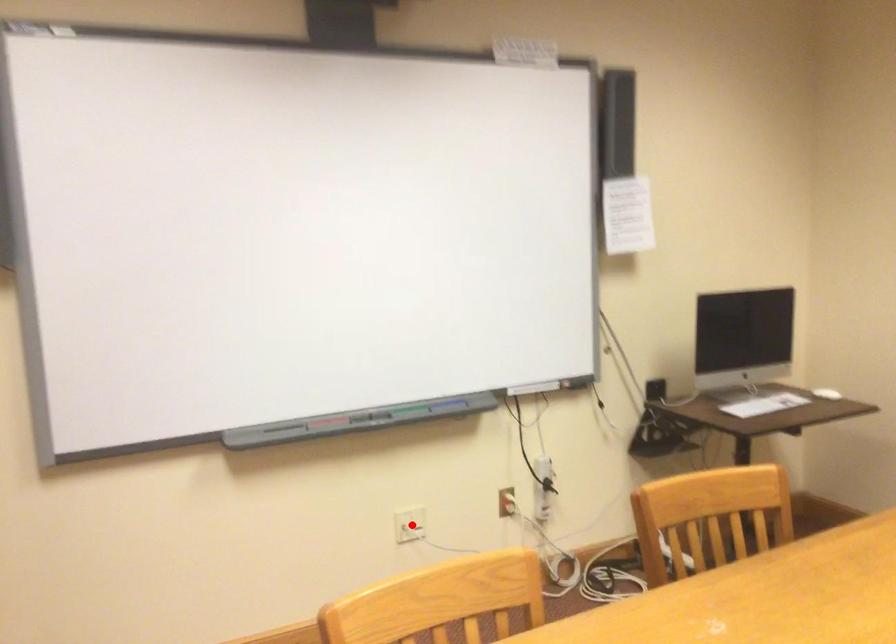
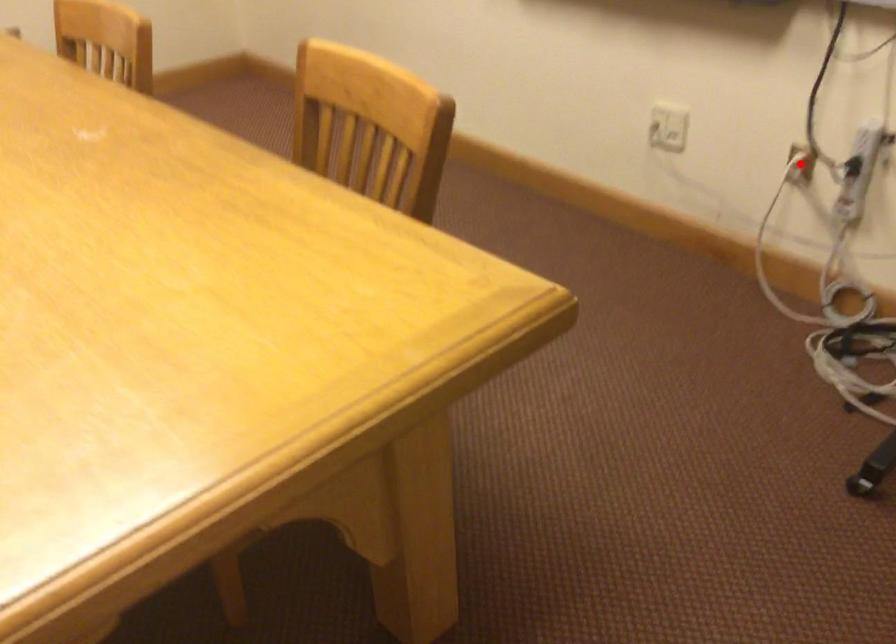
I am providing you with two images of the same scene from different viewpoints. A red point is marked on the first image and another point is marked on the second image. Is the marked point in image1 the same physical position as the marked point in image2?

No